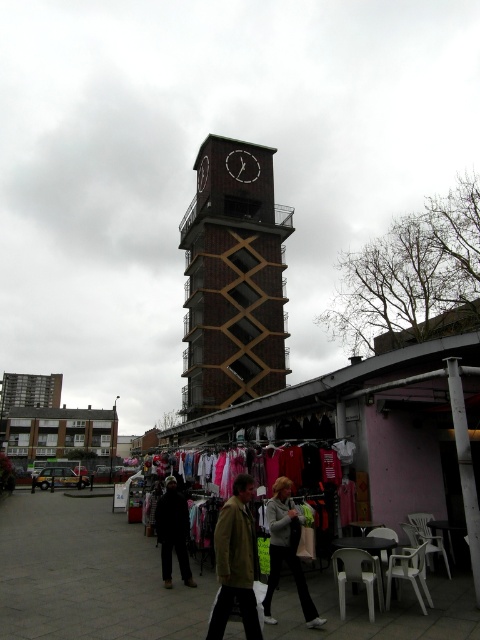
Between green textured jacket at center and gray fleece jacket at center, which one has less height?

Result: gray fleece jacket at center

Which of these two, green textured jacket at center or gray fleece jacket at center, stands taller?

With more height is green textured jacket at center.

The width and height of the screenshot is (480, 640). What are the coordinates of `green textured jacket at center` in the screenshot? It's located at (236, 563).

Between gray fleece jacket at center and white wooden clock at center, which one has more height?

With more height is white wooden clock at center.

Which is in front, point (279, 563) or point (204, 180)?

Point (279, 563) is more forward.

The image size is (480, 640). Identify the location of gray fleece jacket at center. (287, 550).

Locate an element on the screen. The image size is (480, 640). gray fleece jacket at center is located at coordinates (287, 550).

Is gray fleece jacket at center closer to camera compared to black matte clock at upper center?

That is True.

Consider the image. Between gray fleece jacket at center and black matte clock at upper center, which one is positioned lower?

Positioned lower is gray fleece jacket at center.

Is point (268, 624) closer to viewer compared to point (235, 166)?

That is True.

Where is `gray fleece jacket at center`? Image resolution: width=480 pixels, height=640 pixels. gray fleece jacket at center is located at coordinates (287, 550).